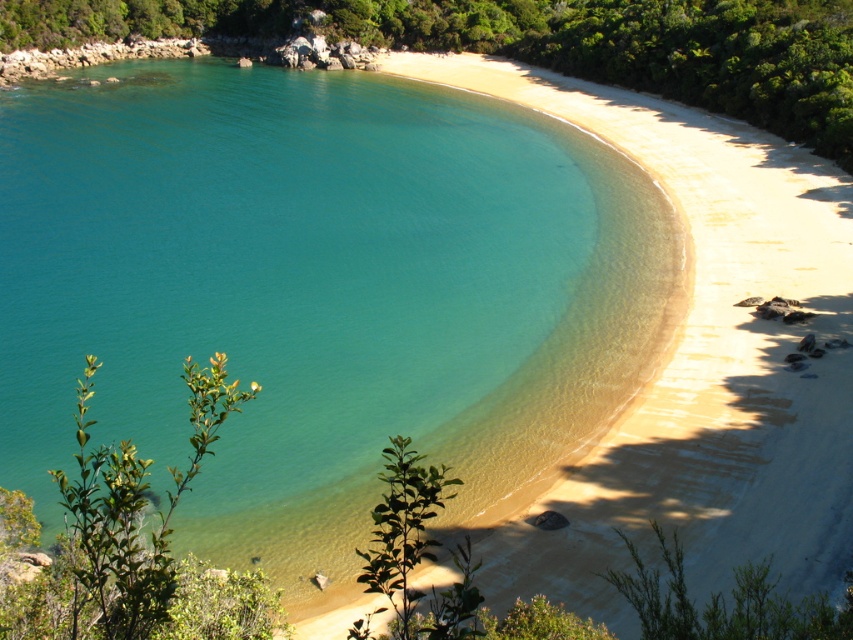
You are standing on the beach and see a point marked at coordinates [541,44]. Based on the scene description, where is this point located?

The point at coordinates [541,44] is located on the green leafy shrub at upper left.